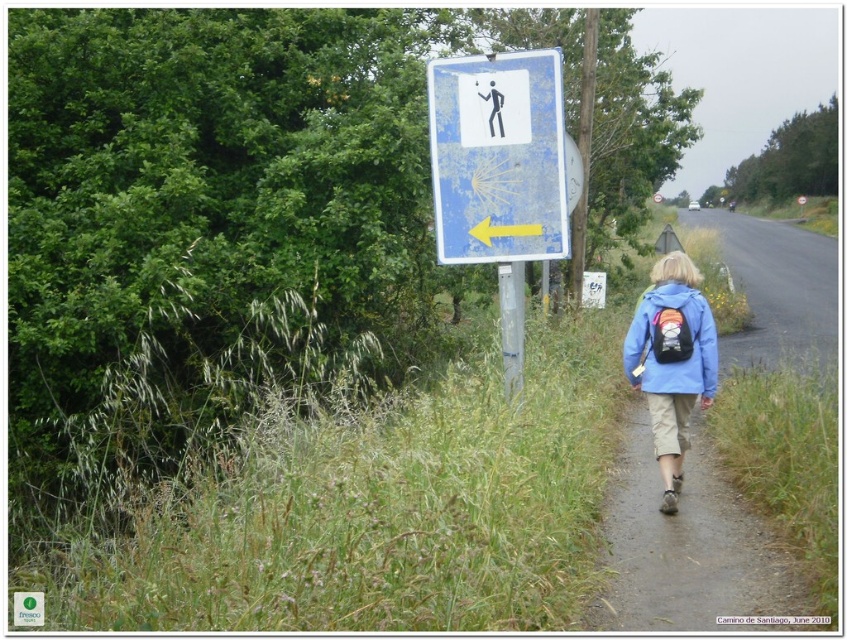
Question: Does dirt path at lower right come behind blue faded sign at upper center?

Choices:
 (A) yes
 (B) no

Answer: (B)

Question: Based on their relative distances, which object is farther from the blue fabric backpack at center-right?

Choices:
 (A) yellow matte arrow at left
 (B) black plastic figure at upper center

Answer: (B)

Question: Which of the following is the closest to the observer?

Choices:
 (A) blue faded sign at upper center
 (B) dirt path at lower right
 (C) yellow matte arrow at left
 (D) blue fabric backpack at center-right

Answer: (B)

Question: Does blue fabric backpack at center-right appear over blue matte jacket at lower right?

Choices:
 (A) no
 (B) yes

Answer: (A)

Question: Which object appears farthest from the camera in this image?

Choices:
 (A) blue matte jacket at lower right
 (B) blue faded sign at upper center
 (C) black plastic figure at upper center

Answer: (A)

Question: Is blue fabric backpack at center-right to the left of yellow matte arrow at left from the viewer's perspective?

Choices:
 (A) no
 (B) yes

Answer: (A)